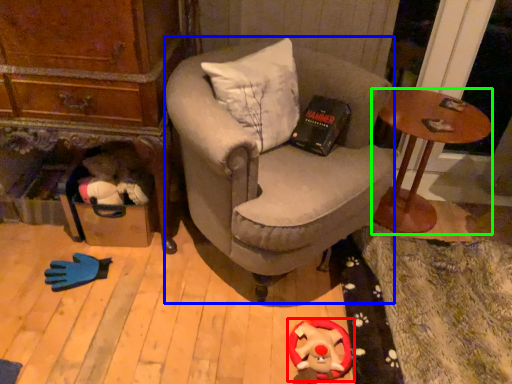
Question: Which object is positioned farthest from toy (highlighted by a red box)? Select from chair (highlighted by a blue box) and desk (highlighted by a green box).

Choices:
 (A) chair
 (B) desk

Answer: (B)